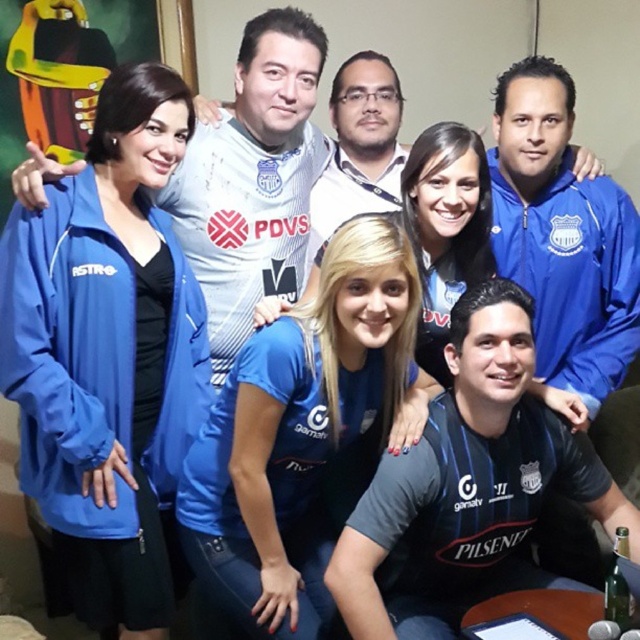
Looking at this image, you are a photographer adjusting the camera focus. You notice the blue fabric jacket at left and the matte white jersey at upper center are both in the frame. Which object should you focus on first if you want to ensure the taller one is sharp?

The blue fabric jacket at left is taller than the matte white jersey at upper center, so you should focus on the blue fabric jacket at left first.

You are a photographer adjusting the camera focus. You want to ensure both the dark gray jersey at lower center and the matte white jersey at upper center are in focus. Which jersey should you focus on first to account for their heights?

The dark gray jersey at lower center has a lesser height compared to the matte white jersey at upper center, so you should focus on the dark gray jersey at lower center first to ensure both are in focus.

You are standing in the room where the group photo was taken. There are two points marked in the image at coordinates point (x=493, y=317) and point (x=236, y=339). If you were to walk from the first point to the second point, would you be moving towards the background of the image or towards the foreground?

Since point (x=493, y=317) is in front of point (x=236, y=339), moving from the first point to the second would mean moving towards the background of the image.